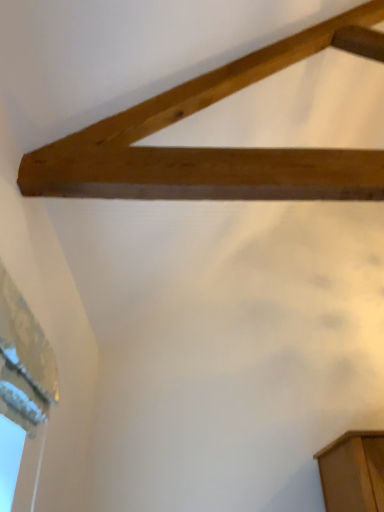
Question: Would you say natural wood plank at upper center is inside or outside white textured paper at upper left?

Choices:
 (A) outside
 (B) inside

Answer: (A)

Question: Does point click(246, 163) appear closer or farther from the camera than point click(34, 331)?

Choices:
 (A) farther
 (B) closer

Answer: (B)

Question: Is natural wood plank at upper center in front of or behind white textured paper at upper left in the image?

Choices:
 (A) behind
 (B) front

Answer: (A)

Question: Considering their positions, is white textured paper at upper left located in front of or behind natural wood plank at upper center?

Choices:
 (A) behind
 (B) front

Answer: (B)

Question: Looking at the image, does white textured paper at upper left seem bigger or smaller compared to natural wood plank at upper center?

Choices:
 (A) small
 (B) big

Answer: (A)

Question: From a real-world perspective, is white textured paper at upper left physically located above or below natural wood plank at upper center?

Choices:
 (A) below
 (B) above

Answer: (A)

Question: Is white textured paper at upper left to the left or to the right of natural wood plank at upper center in the image?

Choices:
 (A) left
 (B) right

Answer: (A)